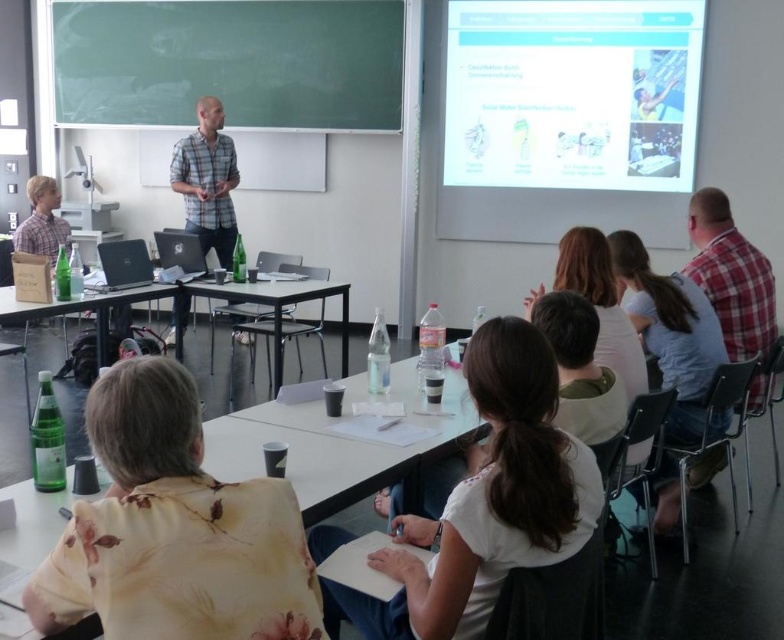
You are standing at the back of the classroom and want to walk to the front. There are two points marked in the room, point A at coordinates point (449, 588) and point B at coordinates point (56, 534). Which point should you aim for to reach the front of the classroom first?

Point A at coordinates point (449, 588) is in front of point B at coordinates point (56, 534), so you should aim for point A to reach the front of the classroom first.

You are standing at the front of the classroom and see two points marked on the floor. The first point is at coordinate point (657, 35) and the second is at point (347, 13). Which point is closer to you?

Point (657, 35) is in front of point (347, 13), so the first point is closer to you.

You are standing at the entrance of the classroom. You need to locate the white glossy projection screen at upper right. According to the coordinates provided, where should you look to find it?

The white glossy projection screen at upper right is located at coordinates point (572, 93).